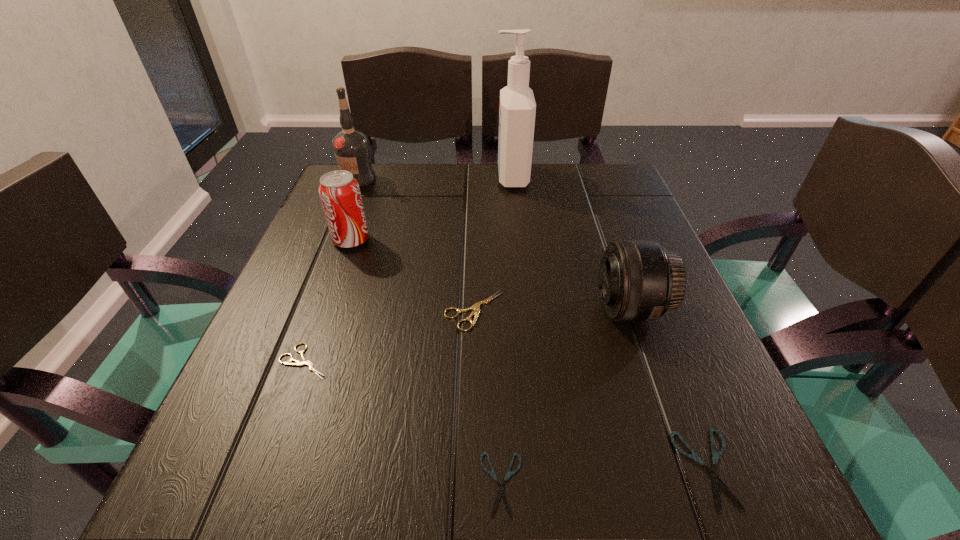
You are a GUI agent. You are given a task and a screenshot of the screen. Output one action in this format:
    pyautogui.click(x=<x>, y=<y>)
    Task: Click on the blank area located on the front-facing side of the telephoto lens
    Image resolution: width=960 pixels, height=540 pixels.
    Given the screenshot: What is the action you would take?
    pyautogui.click(x=520, y=309)

You are a GUI agent. You are given a task and a screenshot of the screen. Output one action in this format:
    pyautogui.click(x=<x>, y=<y>)
    Task: Click on the free spot located on the front of the tallest shears
    The width and height of the screenshot is (960, 540).
    Given the screenshot: What is the action you would take?
    [472, 442]

Where is `vacant point located on the back of the nearer beige shears`? The width and height of the screenshot is (960, 540). vacant point located on the back of the nearer beige shears is located at coordinates (348, 245).

You are a GUI agent. You are given a task and a screenshot of the screen. Output one action in this format:
    pyautogui.click(x=<x>, y=<y>)
    Task: Click on the vacant space located 0.190m on the left of the right black shears
    
    Given the screenshot: What is the action you would take?
    pyautogui.click(x=536, y=469)

At what (x,y) coordinates should I click in order to perform the action: click on free spot located on the back of the shortest object. Please return your answer as a coordinate pair (x, y). This screenshot has width=960, height=540. Looking at the image, I should click on (495, 316).

I want to click on cleansing agent at the far edge, so click(517, 110).

At what (x,y) coordinates should I click in order to perform the action: click on vodka that is positioned at the far edge. Please return your answer as a coordinate pair (x, y). Image resolution: width=960 pixels, height=540 pixels. Looking at the image, I should click on (351, 147).

Find the location of `vodka at the left edge`. vodka at the left edge is located at coordinates (351, 147).

Where is `soda can that is positioned at the left edge`? This screenshot has width=960, height=540. soda can that is positioned at the left edge is located at coordinates (339, 191).

You are a GUI agent. You are given a task and a screenshot of the screen. Output one action in this format:
    pyautogui.click(x=<x>, y=<y>)
    Task: Click on the shears located at the left edge
    The width and height of the screenshot is (960, 540).
    Given the screenshot: What is the action you would take?
    pyautogui.click(x=305, y=361)